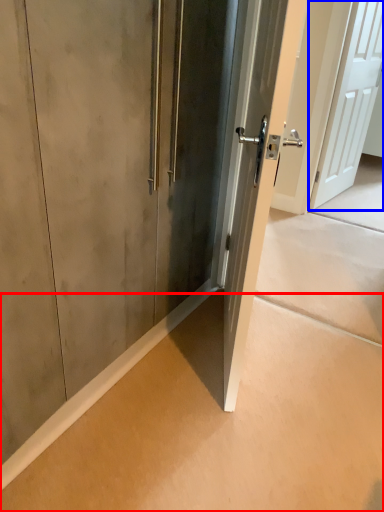
Question: Which object is further to the camera taking this photo, concrete (highlighted by a red box) or door (highlighted by a blue box)?

Choices:
 (A) concrete
 (B) door

Answer: (B)